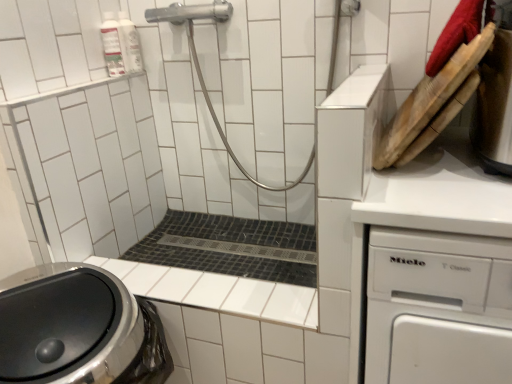
Where is `white plastic dishwasher at right`? The image size is (512, 384). white plastic dishwasher at right is located at coordinates (438, 308).

Based on the photo, measure the distance between stainless steel washing machine at lower left and camera.

The depth of stainless steel washing machine at lower left is 75.83 centimeters.

Where is `stainless steel washing machine at lower left`? stainless steel washing machine at lower left is located at coordinates (78, 329).

This screenshot has height=384, width=512. What do you see at coordinates (232, 247) in the screenshot? I see `black mosaic tile bath at center` at bounding box center [232, 247].

Where is `white plastic dishwasher at right`? The height and width of the screenshot is (384, 512). white plastic dishwasher at right is located at coordinates (438, 308).

Is stainless steel kettle at upper right not inside stainless steel washing machine at lower left?

Indeed, stainless steel kettle at upper right is completely outside stainless steel washing machine at lower left.

Does stainless steel kettle at upper right appear on the left side of stainless steel washing machine at lower left?

In fact, stainless steel kettle at upper right is to the right of stainless steel washing machine at lower left.

Is stainless steel kettle at upper right further to camera compared to stainless steel washing machine at lower left?

That is True.

This screenshot has height=384, width=512. I want to click on appliance behind the stainless steel washing machine at lower left, so click(x=494, y=107).

Between stainless steel washing machine at lower left and stainless steel kettle at upper right, which one has less height?

Standing shorter between the two is stainless steel kettle at upper right.

Is stainless steel washing machine at lower left turned away from stainless steel kettle at upper right?

No, stainless steel kettle at upper right is not at the back of stainless steel washing machine at lower left.

How many degrees apart are the facing directions of stainless steel washing machine at lower left and stainless steel kettle at upper right?

The angle between the facing direction of stainless steel washing machine at lower left and the facing direction of stainless steel kettle at upper right is 91.5 degrees.

In the scene shown: Relative to white plastic dishwasher at right, is stainless steel washing machine at lower left in front or behind?

stainless steel washing machine at lower left is behind white plastic dishwasher at right.

In terms of width, does stainless steel washing machine at lower left look wider or thinner when compared to white plastic dishwasher at right?

Considering their sizes, stainless steel washing machine at lower left looks slimmer than white plastic dishwasher at right.

Is point (138, 370) more distant than point (496, 342)?

That is True.

From the image's perspective, which is above, stainless steel washing machine at lower left or white plastic dishwasher at right?

From the image's view, white plastic dishwasher at right is above.

How distant is white plastic dishwasher at right from stainless steel kettle at upper right?

white plastic dishwasher at right and stainless steel kettle at upper right are 12.70 inches apart.

In the image, is white plastic dishwasher at right on the left side or the right side of stainless steel kettle at upper right?

Clearly, white plastic dishwasher at right is on the left of stainless steel kettle at upper right in the image.

From the image's perspective, is white plastic dishwasher at right over stainless steel kettle at upper right?

Actually, white plastic dishwasher at right appears below stainless steel kettle at upper right in the image.

Does black mosaic tile bath at center turn towards stainless steel washing machine at lower left?

Yes, black mosaic tile bath at center faces towards stainless steel washing machine at lower left.

Does black mosaic tile bath at center touch stainless steel washing machine at lower left?

There is a gap between black mosaic tile bath at center and stainless steel washing machine at lower left.

From the image's perspective, which one is positioned higher, black mosaic tile bath at center or stainless steel washing machine at lower left?

black mosaic tile bath at center is shown above in the image.

Is black mosaic tile bath at center closer to the viewer compared to stainless steel washing machine at lower left?

No.

From the image's perspective, would you say stainless steel washing machine at lower left is shown under black mosaic tile bath at center?

Yes, from the image's perspective, stainless steel washing machine at lower left is below black mosaic tile bath at center.

Who is bigger, stainless steel washing machine at lower left or black mosaic tile bath at center?

With larger size is stainless steel washing machine at lower left.

Is stainless steel washing machine at lower left in front of black mosaic tile bath at center?

Yes, it is.

From the picture: Which object is further away from the camera, stainless steel kettle at upper right or black mosaic tile bath at center?

black mosaic tile bath at center is further away from the camera.

Between point (508, 39) and point (172, 220), which one is positioned behind?

The point (172, 220) is farther from the camera.

From a real-world perspective, which is physically below, stainless steel kettle at upper right or black mosaic tile bath at center?

black mosaic tile bath at center, from a real-world perspective.

In the image, there is a stainless steel kettle at upper right. Where is `bath below it (from the image's perspective)`? bath below it (from the image's perspective) is located at coordinates (232, 247).

Locate an element on the screen. The width and height of the screenshot is (512, 384). appliance on the right of stainless steel washing machine at lower left is located at coordinates (494, 107).

At what (x,y) coordinates should I click in order to perform the action: click on washing machine below the stainless steel kettle at upper right (from a real-world perspective). Please return your answer as a coordinate pair (x, y). The image size is (512, 384). Looking at the image, I should click on (78, 329).

Looking at the image, which one is located closer to stainless steel kettle at upper right, stainless steel washing machine at lower left or white plastic dishwasher at right?

white plastic dishwasher at right is positioned closer to the anchor stainless steel kettle at upper right.

Considering their positions, is white plastic dishwasher at right positioned further to black mosaic tile bath at center than stainless steel kettle at upper right?

stainless steel kettle at upper right lies further to black mosaic tile bath at center than the other object.

Considering their positions, is black mosaic tile bath at center positioned closer to stainless steel kettle at upper right than white plastic dishwasher at right?

white plastic dishwasher at right is closer to stainless steel kettle at upper right.

Estimate the real-world distances between objects in this image. Which object is closer to stainless steel washing machine at lower left, stainless steel kettle at upper right or black mosaic tile bath at center?

Based on the image, black mosaic tile bath at center appears to be nearer to stainless steel washing machine at lower left.

Based on their spatial positions, is stainless steel washing machine at lower left or white plastic dishwasher at right closer to black mosaic tile bath at center?

stainless steel washing machine at lower left lies closer to black mosaic tile bath at center than the other object.

Based on their spatial positions, is black mosaic tile bath at center or stainless steel kettle at upper right closer to stainless steel washing machine at lower left?

black mosaic tile bath at center is closer to stainless steel washing machine at lower left.

Looking at the image, which one is located closer to stainless steel washing machine at lower left, white plastic dishwasher at right or stainless steel kettle at upper right?

white plastic dishwasher at right is closer to stainless steel washing machine at lower left.

Looking at the image, which one is located closer to black mosaic tile bath at center, stainless steel kettle at upper right or stainless steel washing machine at lower left?

Based on the image, stainless steel washing machine at lower left appears to be nearer to black mosaic tile bath at center.

Find the location of `bath located between stainless steel washing machine at lower left and white plastic dishwasher at right in the left-right direction`. bath located between stainless steel washing machine at lower left and white plastic dishwasher at right in the left-right direction is located at coordinates (232, 247).

What are the coordinates of `dish washer between stainless steel washing machine at lower left and stainless steel kettle at upper right in the horizontal direction` in the screenshot? It's located at (438, 308).

Identify the location of dish washer between black mosaic tile bath at center and stainless steel kettle at upper right. The height and width of the screenshot is (384, 512). (438, 308).

I want to click on bath located between stainless steel washing machine at lower left and stainless steel kettle at upper right in the left-right direction, so click(232, 247).